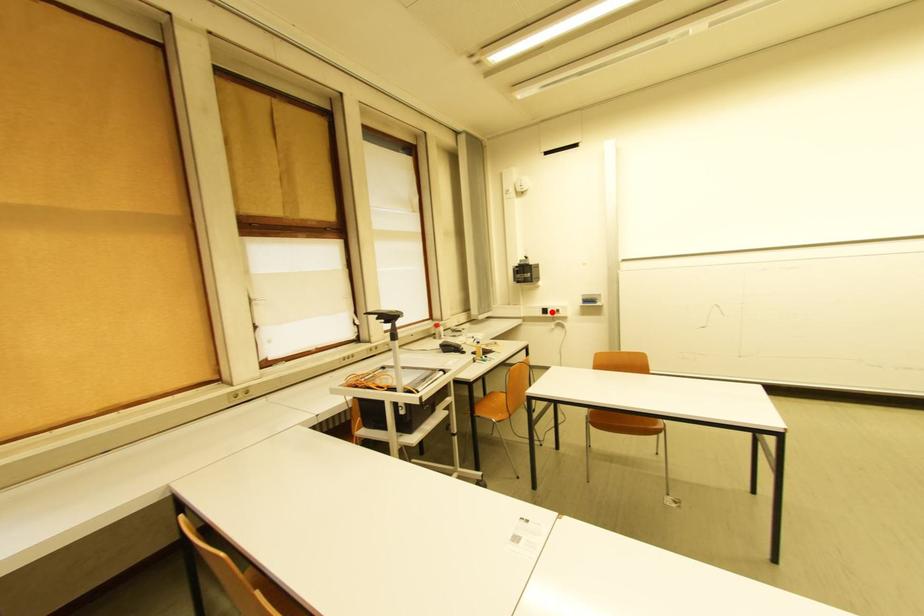
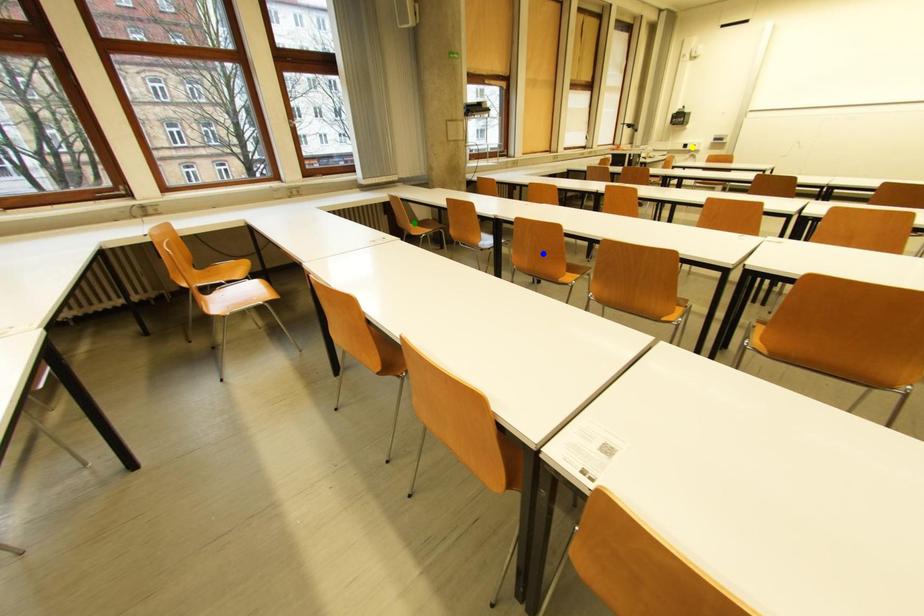
Question: I am providing you with two images of the same scene from different viewpoints. A red point is marked on the first image. You are given multiple points on the second image. In image 2, which mark is for the same physical point as the one in image 1?

Choices:
 (A) green point
 (B) yellow point
 (C) blue point

Answer: (B)